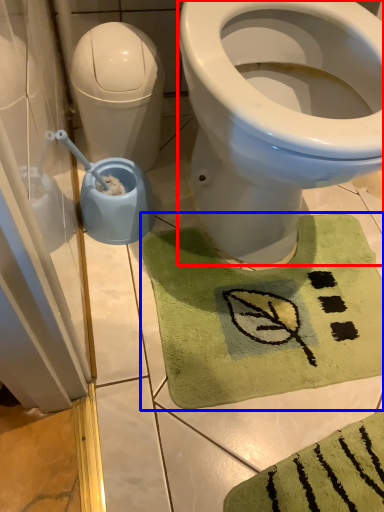
Question: Which object appears farthest to the camera in this image, bidet (highlighted by a red box) or bath mat (highlighted by a blue box)?

Choices:
 (A) bidet
 (B) bath mat

Answer: (B)